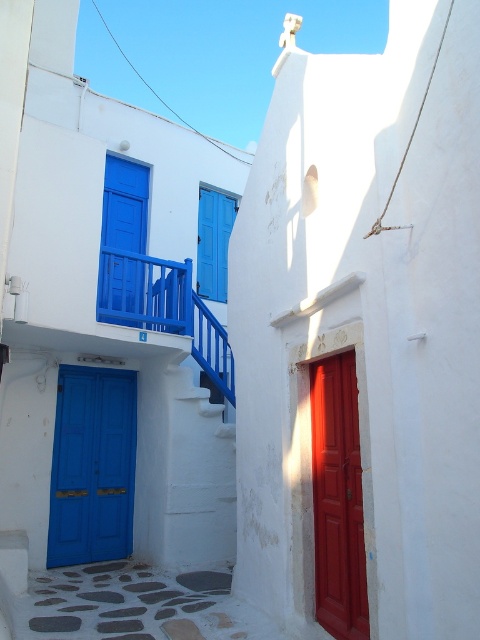
Find the location of `matte blue door at left`. matte blue door at left is located at coordinates (93, 465).

Who is more distant from viewer, (81, 513) or (103, 320)?

The point (81, 513) is more distant.

Where is `matte blue door at left`? matte blue door at left is located at coordinates (93, 465).

Can you confirm if smooth glossy wood door at right is wider than blue painted wood shutter at center?

No.

At what (x,y) coordinates should I click in order to perform the action: click on smooth glossy wood door at right. Please return your answer as a coordinate pair (x, y). Looking at the image, I should click on (337, 499).

Looking at this image, does matte blue door at center have a lesser height compared to blue painted wood shutter at center?

Yes, matte blue door at center is shorter than blue painted wood shutter at center.

Does matte blue door at center appear over blue painted wood shutter at center?

No, matte blue door at center is not above blue painted wood shutter at center.

Is point (124, 177) in front of point (204, 262)?

Yes.

Locate an element on the screen. matte blue door at center is located at coordinates (122, 236).